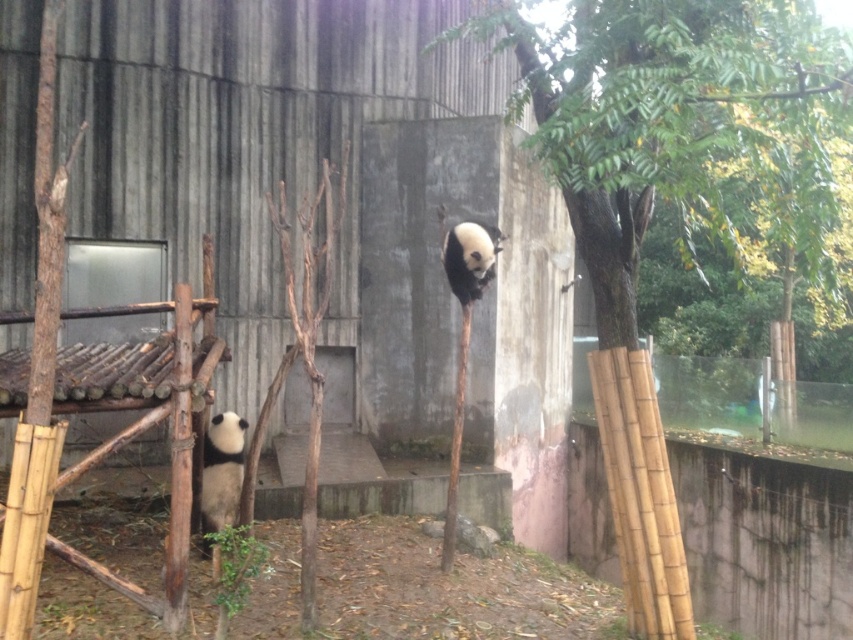
You are a zookeeper standing at the entrance of the panda enclosure. You notice a green leafy tree at upper right that you need to water. Considering your watering can has a maximum reach of 3 meters, can you water the tree without moving closer?

The green leafy tree at upper right is 3.23 meters from viewer. Since the watering can has a maximum reach of 3 meters, you cannot reach the tree without moving closer.